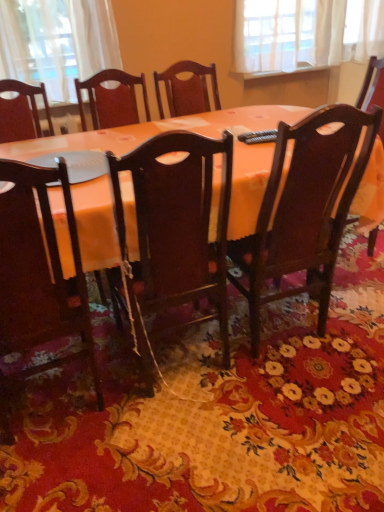
The width and height of the screenshot is (384, 512). In order to click on free space in front of wooden chair at center, which appears as the second chair when viewed from the left in this screenshot , I will do `click(187, 452)`.